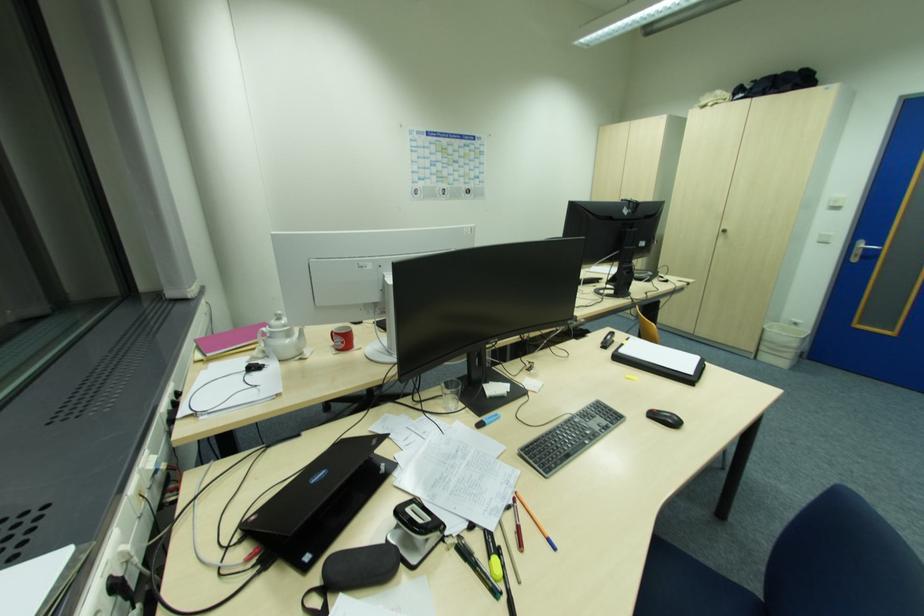
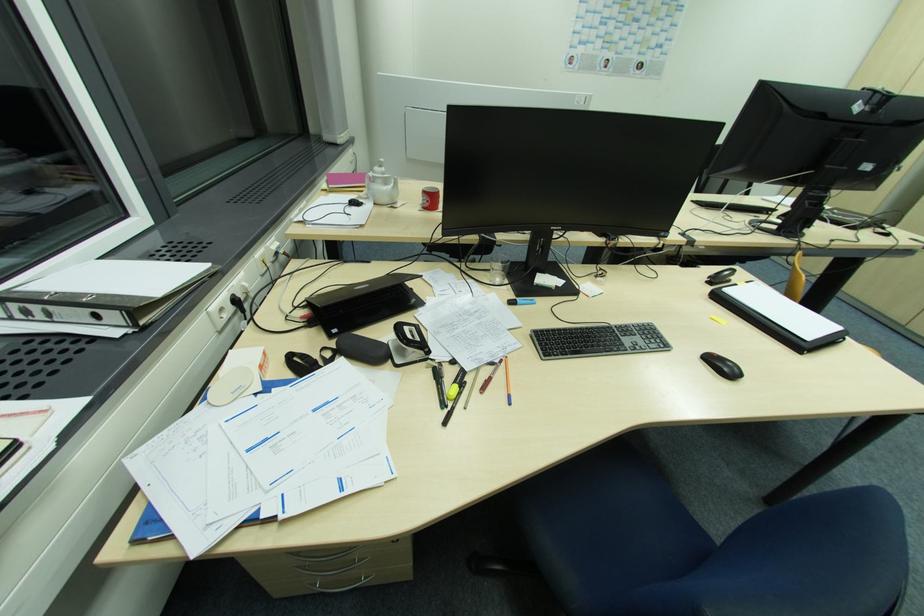
Locate, in the second image, the point that corresponds to point 444,397 in the first image.

(493, 270)